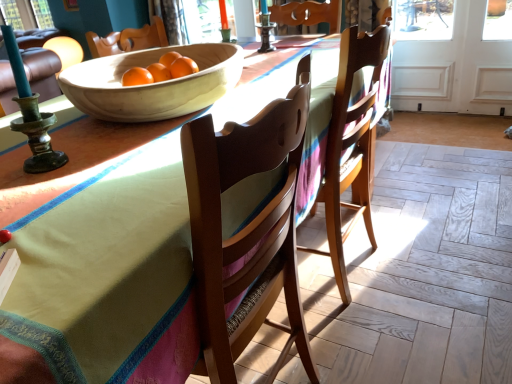
Question: From the image's perspective, would you say natural wood bowl at center is shown under matte dark brown candle holder at upper center?

Choices:
 (A) no
 (B) yes

Answer: (B)

Question: Could matte dark brown candle holder at upper center be considered to be inside natural wood bowl at center?

Choices:
 (A) yes
 (B) no

Answer: (B)

Question: Is natural wood bowl at center at the left side of matte dark brown candle holder at upper center?

Choices:
 (A) yes
 (B) no

Answer: (A)

Question: Is natural wood bowl at center far from matte dark brown candle holder at upper center?

Choices:
 (A) yes
 (B) no

Answer: (B)

Question: Is natural wood bowl at center thinner than matte dark brown candle holder at upper center?

Choices:
 (A) yes
 (B) no

Answer: (B)

Question: Could you tell me if natural wood bowl at center is turned towards matte dark brown candle holder at upper center?

Choices:
 (A) yes
 (B) no

Answer: (B)

Question: Considering the relative positions of white wood screen door at right and matte dark brown candle holder at upper center in the image provided, is white wood screen door at right to the right of matte dark brown candle holder at upper center from the viewer's perspective?

Choices:
 (A) yes
 (B) no

Answer: (A)

Question: From the image's perspective, is white wood screen door at right under matte dark brown candle holder at upper center?

Choices:
 (A) yes
 (B) no

Answer: (B)

Question: Is white wood screen door at right smaller than matte dark brown candle holder at upper center?

Choices:
 (A) yes
 (B) no

Answer: (B)

Question: Is white wood screen door at right with matte dark brown candle holder at upper center?

Choices:
 (A) no
 (B) yes

Answer: (A)

Question: Is white wood screen door at right surrounding matte dark brown candle holder at upper center?

Choices:
 (A) no
 (B) yes

Answer: (A)

Question: From a real-world perspective, is white wood screen door at right physically below matte dark brown candle holder at upper center?

Choices:
 (A) no
 (B) yes

Answer: (B)

Question: Is the depth of wooden table at center less than that of matte dark brown candle holder at upper center?

Choices:
 (A) no
 (B) yes

Answer: (B)